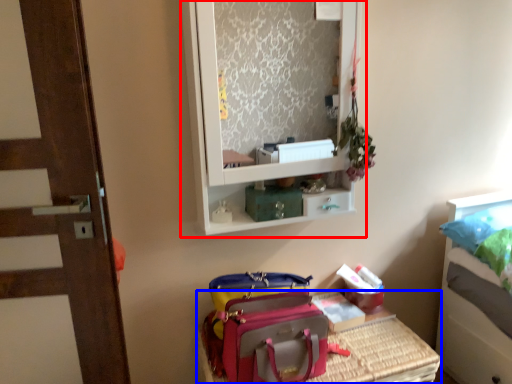
Question: Among these objects, which one is farthest to the camera, medicine cabinet (highlighted by a red box) or furniture (highlighted by a blue box)?

Choices:
 (A) medicine cabinet
 (B) furniture

Answer: (B)